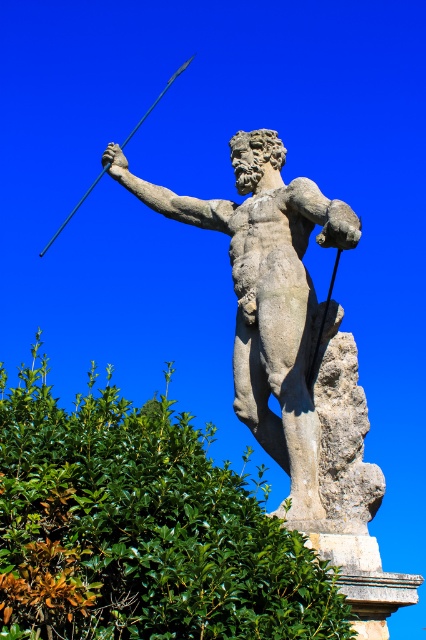
Question: Which point is farther to the camera?

Choices:
 (A) smooth metal spear at upper left
 (B) stone statue at center
 (C) green leafy hedge at upper center

Answer: (A)

Question: Which point appears farthest from the camera in this image?

Choices:
 (A) (75, 208)
 (B) (258, 332)

Answer: (A)

Question: Is stone statue at center closer to camera compared to smooth metal spear at upper left?

Choices:
 (A) yes
 (B) no

Answer: (A)

Question: Is green leafy hedge at upper center further to the viewer compared to stone statue at center?

Choices:
 (A) yes
 (B) no

Answer: (B)

Question: Estimate the real-world distances between objects in this image. Which object is closer to the stone statue at center?

Choices:
 (A) green leafy hedge at upper center
 (B) smooth metal spear at upper left

Answer: (B)

Question: Considering the relative positions of stone statue at center and smooth metal spear at upper left in the image provided, where is stone statue at center located with respect to smooth metal spear at upper left?

Choices:
 (A) right
 (B) left

Answer: (A)